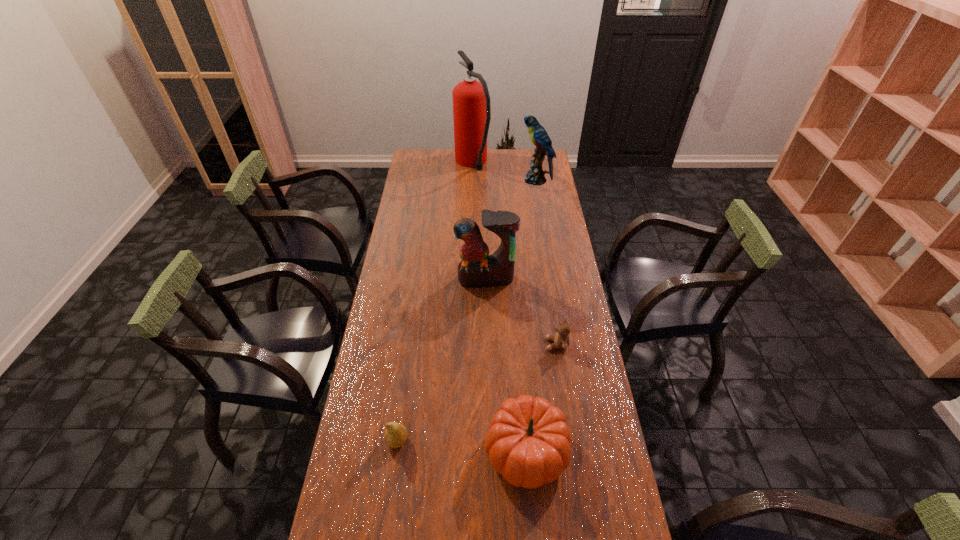
The width and height of the screenshot is (960, 540). I want to click on fire extinguisher, so click(471, 101).

Where is `the right parrot`? the right parrot is located at coordinates (538, 135).

Locate an element on the screen. the fourth nearest object is located at coordinates (477, 268).

Locate an element on the screen. the nearer parrot is located at coordinates (477, 268).

This screenshot has width=960, height=540. I want to click on pumpkin, so click(528, 442).

Locate an element on the screen. Image resolution: width=960 pixels, height=540 pixels. the fourth farthest object is located at coordinates (561, 339).

Find the location of a particular element. pear is located at coordinates (395, 436).

The width and height of the screenshot is (960, 540). Find the location of `free space located 0.140m on the face of the right parrot`. free space located 0.140m on the face of the right parrot is located at coordinates (492, 180).

Image resolution: width=960 pixels, height=540 pixels. Find the location of `vacant space located on the face of the right parrot`. vacant space located on the face of the right parrot is located at coordinates (475, 180).

The height and width of the screenshot is (540, 960). Find the location of `vacant space situated on the face of the right parrot`. vacant space situated on the face of the right parrot is located at coordinates (489, 180).